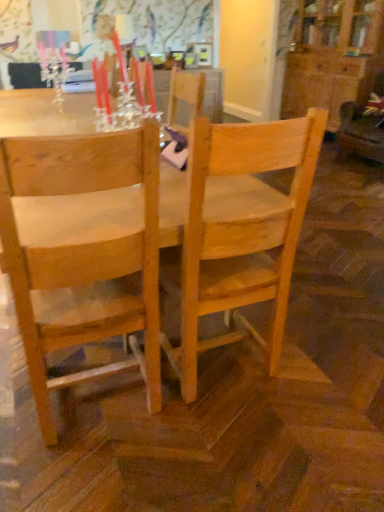
Question: Is natural wood chair at left, which is the 1th chair from left to right, wider or thinner than matte glass candle holder at upper left?

Choices:
 (A) wide
 (B) thin

Answer: (A)

Question: In the image, is natural wood chair at left, which is the 1th chair from left to right, positioned in front of or behind matte glass candle holder at upper left?

Choices:
 (A) behind
 (B) front

Answer: (B)

Question: Which is farther from the velvet brown swivel chair at right?

Choices:
 (A) natural wood chair at center, positioned as the first chair in right-to-left order
 (B) natural wood table at center
 (C) natural wood chair at left, which is the 1th chair from left to right
 (D) matte glass candle holder at upper left

Answer: (C)

Question: Estimate the real-world distances between objects in this image. Which object is farther from the velvet brown swivel chair at right?

Choices:
 (A) natural wood chair at left, which is the 1th chair from left to right
 (B) natural wood table at center
 (C) natural wood chair at center, positioned as the first chair in right-to-left order
 (D) matte glass candle holder at upper left

Answer: (A)